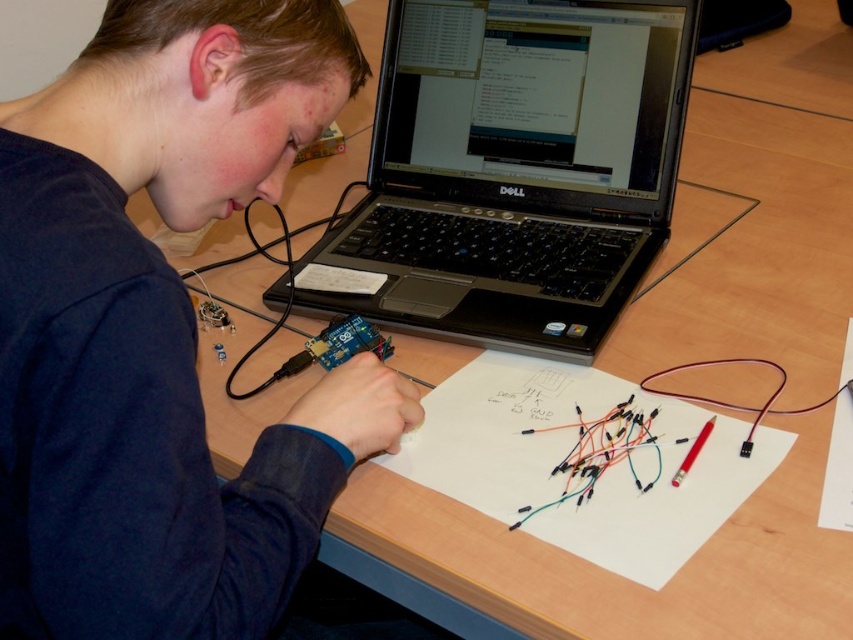
Is dark blue fabric at upper left shorter than black plastic laptop at center?

No.

Can you confirm if dark blue fabric at upper left is smaller than black plastic laptop at center?

Indeed, dark blue fabric at upper left has a smaller size compared to black plastic laptop at center.

The width and height of the screenshot is (853, 640). Identify the location of dark blue fabric at upper left. (160, 330).